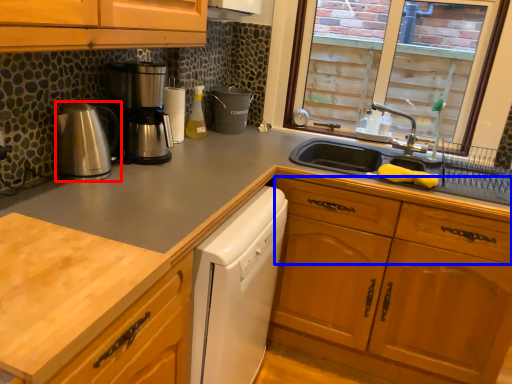
Question: Which object is further to the camera taking this photo, kitchen appliance (highlighted by a red box) or drawer (highlighted by a blue box)?

Choices:
 (A) kitchen appliance
 (B) drawer

Answer: (B)